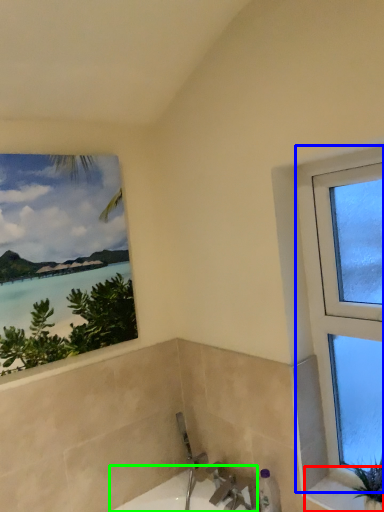
Question: Based on their relative distances, which object is farther from window sill (highlighted by a red box)? Choose from window (highlighted by a blue box) and bath (highlighted by a green box).

Choices:
 (A) window
 (B) bath

Answer: (B)